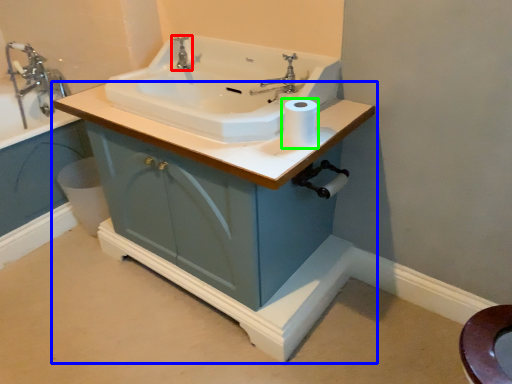
Question: Which object is the farthest from tap (highlighted by a red box)? Choose among these: bathroom cabinet (highlighted by a blue box) or toilet paper (highlighted by a green box).

Choices:
 (A) bathroom cabinet
 (B) toilet paper

Answer: (A)